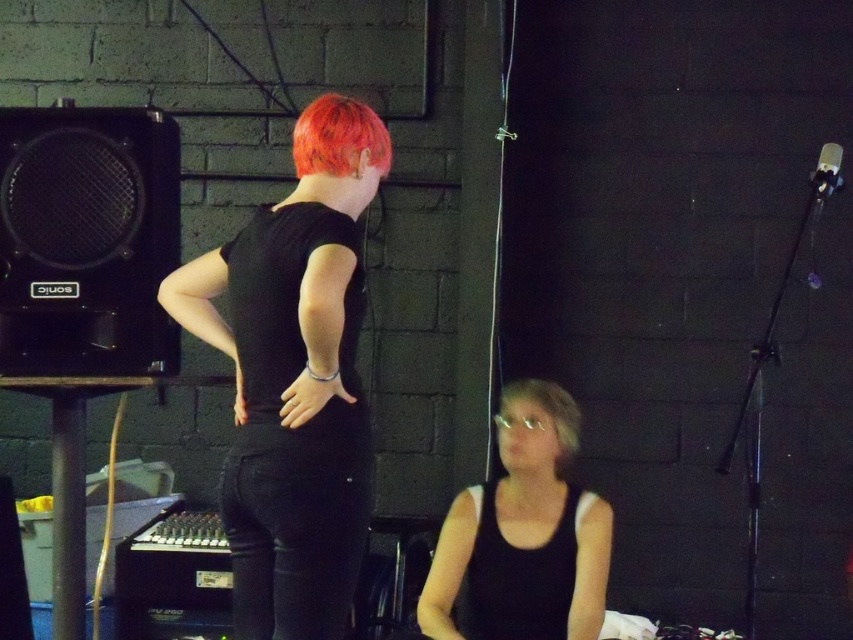
Question: Which point is farther to the camera?

Choices:
 (A) (310, 141)
 (B) (489, 560)
 (C) (556, 419)

Answer: (C)

Question: Which is nearer to the blonde hair at lower center?

Choices:
 (A) black matte jeans at center
 (B) black mesh speaker at left
 (C) bright orange hair at upper center

Answer: (C)

Question: Is black matte tank top at lower center positioned at the back of blonde hair at lower center?

Choices:
 (A) yes
 (B) no

Answer: (B)

Question: Does black matte jeans at center appear under bright orange hair at upper center?

Choices:
 (A) yes
 (B) no

Answer: (A)

Question: Which point appears closest to the camera in this image?

Choices:
 (A) (80, 138)
 (B) (233, 488)
 (C) (456, 516)

Answer: (B)

Question: Can you confirm if black matte jeans at center is bigger than blonde hair at lower center?

Choices:
 (A) no
 (B) yes

Answer: (B)